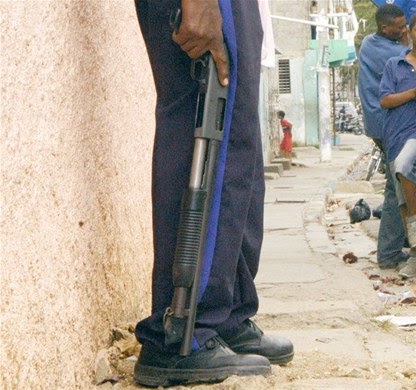
The image size is (416, 390). I want to click on wall, so click(x=52, y=271).